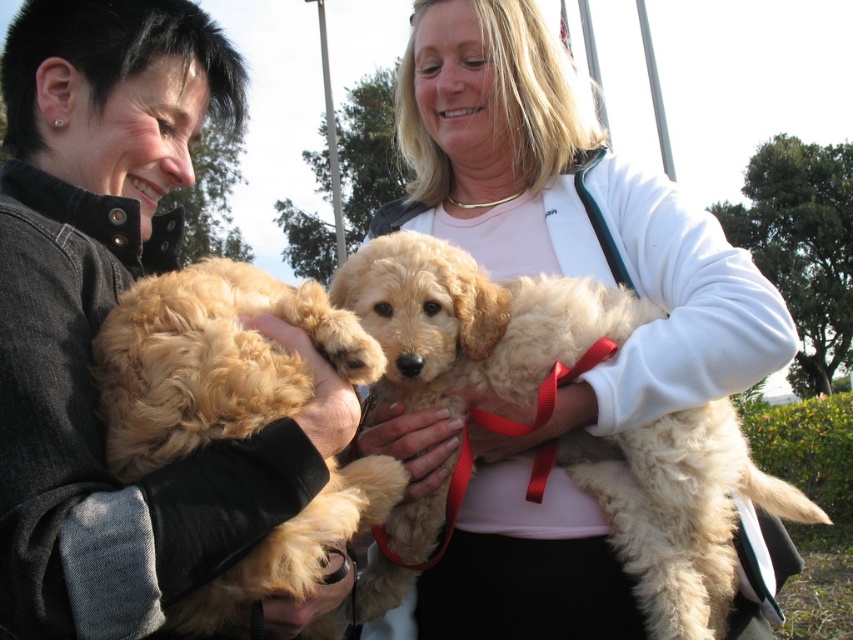
You are a photographer trying to capture a clear photo of both the fluffy golden fur at left and the fluffy beige puppy at center. Which one should you focus on first to ensure it appears sharp in the image?

You should focus on the fluffy golden fur at left first because it is closer to the viewer than the fluffy beige puppy at center, so focusing on the closer object ensures it will be sharp.